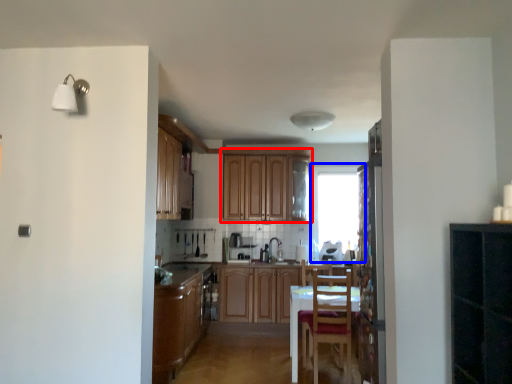
Question: Among these objects, which one is nearest to the camera, cabinetry (highlighted by a red box) or window (highlighted by a blue box)?

Choices:
 (A) cabinetry
 (B) window

Answer: (A)